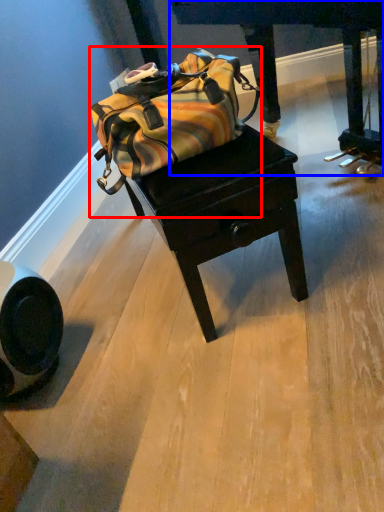
Question: Which point is closer to the camera, luggage and bags (highlighted by a red box) or furniture (highlighted by a blue box)?

Choices:
 (A) luggage and bags
 (B) furniture

Answer: (A)